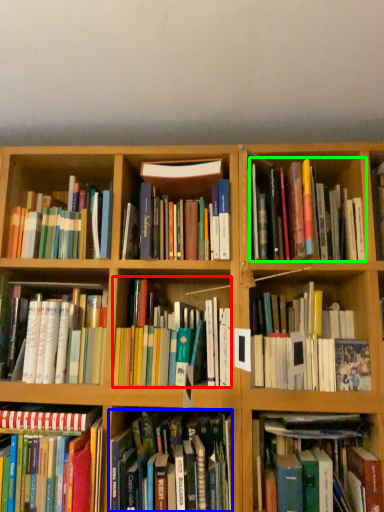
Question: Which object is positioned closest to book (highlighted by a red box)? Select from book (highlighted by a blue box) and book (highlighted by a green box).

Choices:
 (A) book
 (B) book

Answer: (A)